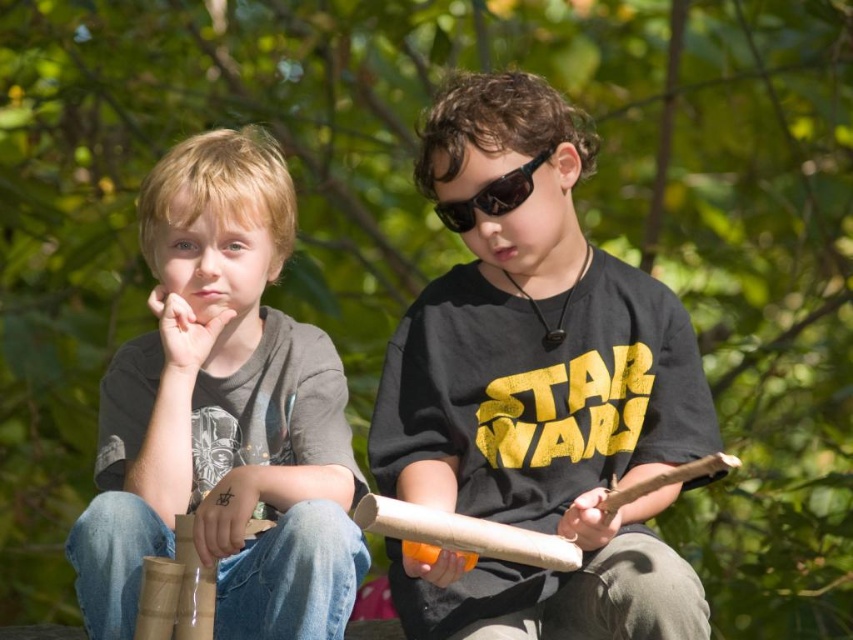
You are standing in front of the two boys in the image. You notice two points marked in the scene. Which point, point 1 at coordinates (318, 586) or point 2 at (490, 202), is closer to you?

Point 1 at coordinates (318, 586) is closer to the viewer than point 2 at (490, 202).